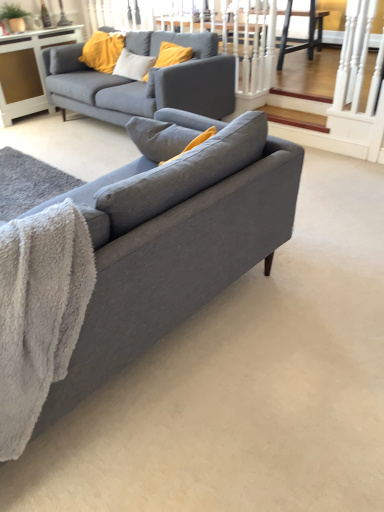
Question: Considering the relative positions of matte gray couch at center, which is counted as the 2th studio couch, starting from the front, and white glossy cabinet at upper left in the image provided, is matte gray couch at center, which is counted as the 2th studio couch, starting from the front, to the right of white glossy cabinet at upper left from the viewer's perspective?

Choices:
 (A) yes
 (B) no

Answer: (A)

Question: Considering the relative sizes of matte gray couch at center, the first studio couch from the top, and white glossy cabinet at upper left in the image provided, is matte gray couch at center, the first studio couch from the top, taller than white glossy cabinet at upper left?

Choices:
 (A) yes
 (B) no

Answer: (A)

Question: Does matte gray couch at center, which is counted as the 2th studio couch, starting from the front, come in front of white glossy cabinet at upper left?

Choices:
 (A) no
 (B) yes

Answer: (B)

Question: Is matte gray couch at center, the first studio couch from the top, surrounding white glossy cabinet at upper left?

Choices:
 (A) yes
 (B) no

Answer: (B)

Question: Does matte gray couch at center, the 1th studio couch when ordered from back to front, have a smaller size compared to white glossy cabinet at upper left?

Choices:
 (A) yes
 (B) no

Answer: (B)

Question: Is point (13, 311) closer or farther from the camera than point (263, 173)?

Choices:
 (A) closer
 (B) farther

Answer: (A)

Question: Considering the positions of gray fluffy blanket at lower left and matte gray couch at center, the first studio couch in the front-to-back sequence, in the image, is gray fluffy blanket at lower left wider or thinner than matte gray couch at center, the first studio couch in the front-to-back sequence,?

Choices:
 (A) thin
 (B) wide

Answer: (A)

Question: Is gray fluffy blanket at lower left situated inside matte gray couch at center, which is the second studio couch in top-to-bottom order, or outside?

Choices:
 (A) outside
 (B) inside

Answer: (B)

Question: Is gray fluffy blanket at lower left taller or shorter than matte gray couch at center, arranged as the first studio couch when ordered from the bottom?

Choices:
 (A) short
 (B) tall

Answer: (A)

Question: Is matte gray couch at center, the first studio couch from the top, spatially inside white glossy cabinet at upper left, or outside of it?

Choices:
 (A) inside
 (B) outside

Answer: (B)

Question: In the image, is matte gray couch at center, the 1th studio couch when ordered from back to front, positioned in front of or behind white glossy cabinet at upper left?

Choices:
 (A) front
 (B) behind

Answer: (A)

Question: From the image's perspective, is matte gray couch at center, the 1th studio couch when ordered from back to front, located above or below white glossy cabinet at upper left?

Choices:
 (A) below
 (B) above

Answer: (A)

Question: Visually, is matte gray couch at center, the 1th studio couch when ordered from back to front, positioned to the left or to the right of white glossy cabinet at upper left?

Choices:
 (A) left
 (B) right

Answer: (B)

Question: From a real-world perspective, is matte gray couch at center, the first studio couch in the front-to-back sequence, positioned above or below gray fluffy blanket at lower left?

Choices:
 (A) above
 (B) below

Answer: (B)

Question: Looking at their shapes, would you say matte gray couch at center, the first studio couch in the front-to-back sequence, is wider or thinner than gray fluffy blanket at lower left?

Choices:
 (A) wide
 (B) thin

Answer: (A)